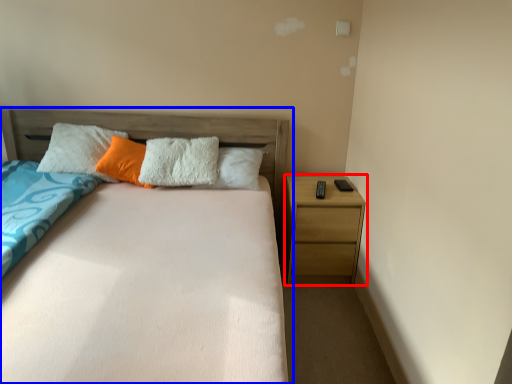
Question: Which of the following is the farthest to the observer, nightstand (highlighted by a red box) or bed (highlighted by a blue box)?

Choices:
 (A) nightstand
 (B) bed

Answer: (A)